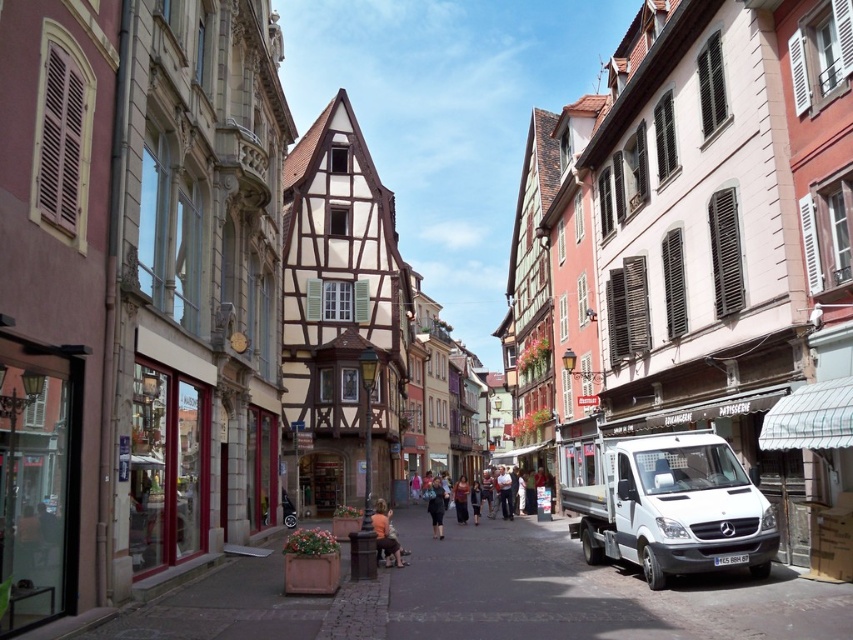
Question: Which object appears farthest from the camera in this image?

Choices:
 (A) dark brown leather jacket at center
 (B) dark blue jeans at center
 (C) matte black jacket at center

Answer: (A)

Question: Which object appears closest to the camera in this image?

Choices:
 (A) matte black jacket at center
 (B) dark brown leather jacket at center
 (C) dark blue jeans at center
 (D) white metallic van at lower right

Answer: (D)

Question: Can you confirm if white metallic van at lower right is smaller than matte black jacket at center?

Choices:
 (A) yes
 (B) no

Answer: (B)

Question: Can you confirm if white metallic van at lower right is thinner than dark brown leather jacket at center?

Choices:
 (A) yes
 (B) no

Answer: (B)

Question: Where is white metallic van at lower right located in relation to matte black jacket at center in the image?

Choices:
 (A) above
 (B) below

Answer: (A)

Question: Based on their relative distances, which object is nearer to the dark brown leather jacket at center?

Choices:
 (A) white metallic van at lower right
 (B) dark blue jeans at center
 (C) matte black jacket at center

Answer: (B)